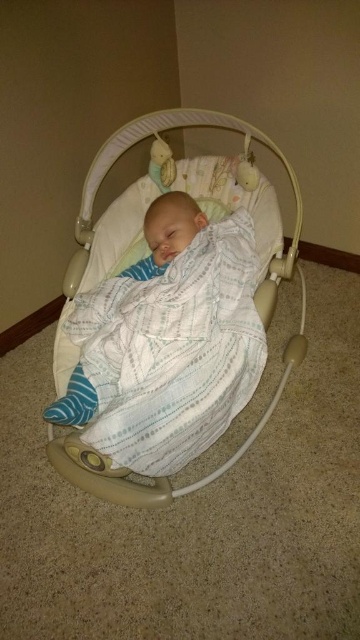
Is white textured blanket at center to the left of soft plush toy at upper center from the viewer's perspective?

No, white textured blanket at center is not to the left of soft plush toy at upper center.

Is white textured blanket at center wider than soft plush toy at upper center?

Indeed, white textured blanket at center has a greater width compared to soft plush toy at upper center.

Where is `white textured blanket at center`? The height and width of the screenshot is (640, 360). white textured blanket at center is located at coordinates (167, 232).

Between point (261, 291) and point (167, 168), which one is positioned in front?

Positioned in front is point (261, 291).

Can you confirm if beige fabric baby swing at center is taller than soft plush toy at upper center?

Correct, beige fabric baby swing at center is much taller as soft plush toy at upper center.

Who is more forward, [86,209] or [149,170]?

Point [86,209] is more forward.

Where is `beige fabric baby swing at center`? beige fabric baby swing at center is located at coordinates (185, 125).

Describe the element at coordinates (185, 125) in the screenshot. The image size is (360, 640). I see `beige fabric baby swing at center` at that location.

Between beige fabric baby swing at center and white textured blanket at center, which one appears on the left side from the viewer's perspective?

Positioned to the left is white textured blanket at center.

Who is more distant from viewer, [48,440] or [156,230]?

Positioned behind is point [48,440].

Where is `beige fabric baby swing at center`? This screenshot has height=640, width=360. beige fabric baby swing at center is located at coordinates (185, 125).